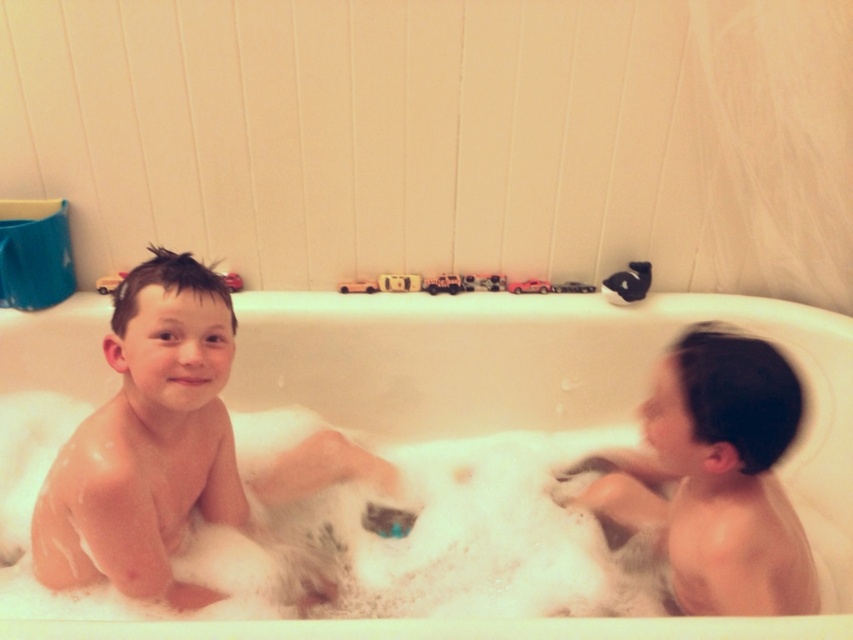
Between white foamy bath at center and foamy white at bath bottom, which one is positioned higher?

white foamy bath at center is above.

Measure the distance between point (815, 348) and camera.

A distance of 1.55 meters exists between point (815, 348) and camera.

What are the coordinates of `white foamy bath at center` in the screenshot? It's located at (531, 369).

Who is positioned more to the right, white foamy bath at center or smooth skin child at right?

smooth skin child at right is more to the right.

Is white foamy bath at center taller than smooth skin child at right?

Yes, white foamy bath at center is taller than smooth skin child at right.

Is point (525, 301) positioned before point (689, 509)?

That is False.

The image size is (853, 640). What are the coordinates of `white foamy bath at center` in the screenshot? It's located at (531, 369).

The height and width of the screenshot is (640, 853). Describe the element at coordinates (364, 536) in the screenshot. I see `foamy white at bath bottom` at that location.

In the scene shown: How much distance is there between foamy white at bath bottom and smooth skin child at right?

foamy white at bath bottom and smooth skin child at right are 14.05 inches apart.

Does point (73, 404) come in front of point (672, 529)?

No, (73, 404) is behind (672, 529).

This screenshot has width=853, height=640. In order to click on foamy white at bath bottom in this screenshot , I will do `click(364, 536)`.